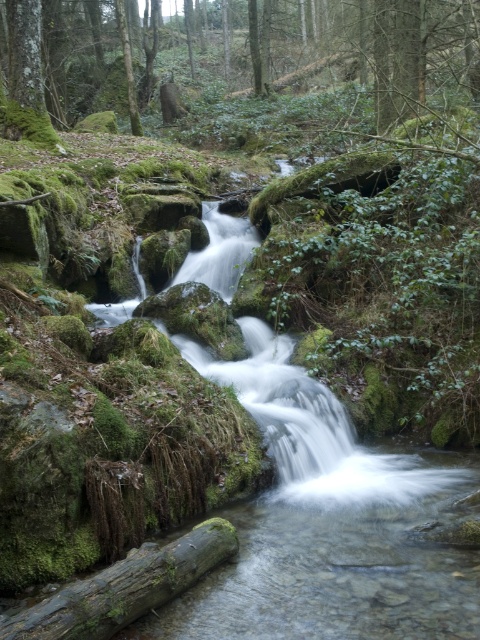
Question: Is green mossy tree at upper center further to the viewer compared to green mossy log at lower center?

Choices:
 (A) no
 (B) yes

Answer: (B)

Question: Which point is closer to the camera?

Choices:
 (A) green mossy log at lower center
 (B) green mossy tree at upper center

Answer: (A)

Question: Does green mossy tree at upper center appear on the right side of green mossy log at lower center?

Choices:
 (A) yes
 (B) no

Answer: (B)

Question: Is green mossy tree at upper center above green mossy log at lower center?

Choices:
 (A) yes
 (B) no

Answer: (A)